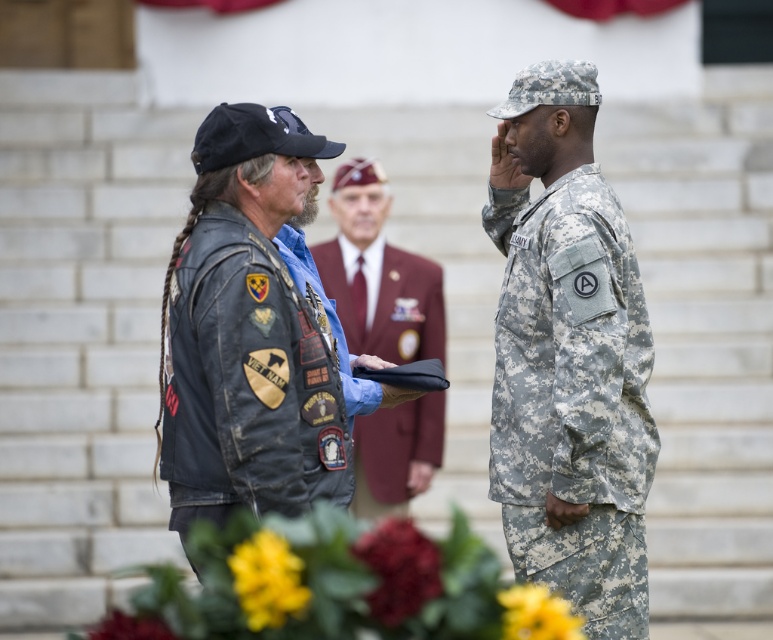
Is camouflage fabric uniform at right to the right of maroon fabric suit at center from the viewer's perspective?

Yes, camouflage fabric uniform at right is to the right of maroon fabric suit at center.

Find the location of a particular element. camouflage fabric uniform at right is located at coordinates (571, 396).

Describe the element at coordinates (571, 396) in the screenshot. The width and height of the screenshot is (773, 640). I see `camouflage fabric uniform at right` at that location.

Locate an element on the screen. camouflage fabric uniform at right is located at coordinates (571, 396).

Is leather jacket at left positioned before maroon fabric suit at center?

Yes, leather jacket at left is closer to the viewer.

Can you confirm if leather jacket at left is positioned to the left of maroon fabric suit at center?

Correct, you'll find leather jacket at left to the left of maroon fabric suit at center.

Between point (298, 483) and point (380, 445), which one is positioned in front?

Point (298, 483)

Where is `leather jacket at left`? The image size is (773, 640). leather jacket at left is located at coordinates (247, 381).

Image resolution: width=773 pixels, height=640 pixels. What do you see at coordinates (571, 396) in the screenshot?
I see `camouflage fabric uniform at right` at bounding box center [571, 396].

Is camouflage fabric uniform at right further to camera compared to leather jacket at left?

Yes, camouflage fabric uniform at right is further from the viewer.

You are a GUI agent. You are given a task and a screenshot of the screen. Output one action in this format:
    pyautogui.click(x=<x>, y=<y>)
    Task: Click on the camouflage fabric uniform at right
    
    Given the screenshot: What is the action you would take?
    pyautogui.click(x=571, y=396)